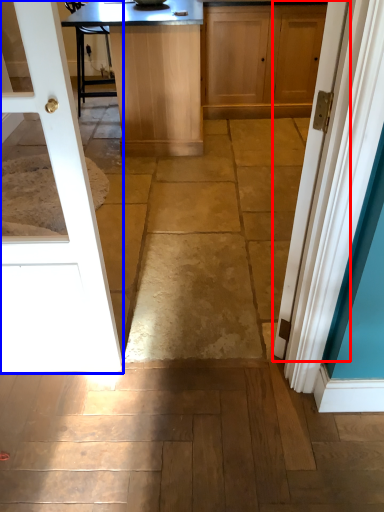
Question: Which point is closer to the camera, door (highlighted by a red box) or door (highlighted by a blue box)?

Choices:
 (A) door
 (B) door

Answer: (B)